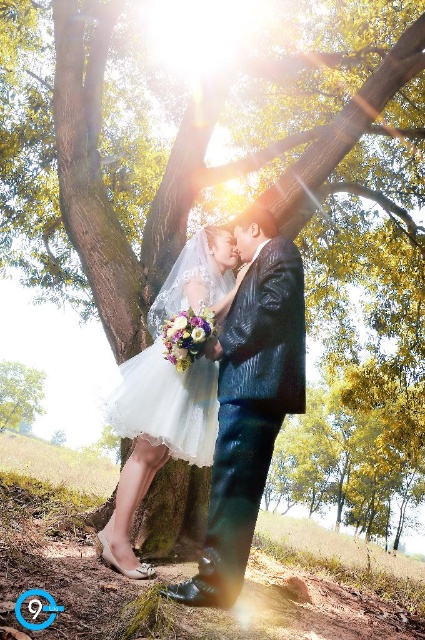
Measure the distance between shiny dark blue suit at center and camera.

shiny dark blue suit at center is 3.25 meters away from camera.

Who is more distant from viewer, (243, 552) or (14, 365)?

The point (14, 365) is more distant.

You are a GUI agent. You are given a task and a screenshot of the screen. Output one action in this format:
    pyautogui.click(x=<x>, y=<y>)
    Task: Click on the shiny dark blue suit at center
    
    Given the screenshot: What is the action you would take?
    (x=249, y=401)

Identify the location of shiny dark blue suit at center. (249, 401).

Can you confirm if matte white dress at center is smaller than green leafy tree at lower left?

Yes.

Measure the distance between matte white dress at center and camera.

The distance of matte white dress at center from camera is 3.66 meters.

Find the location of a particular element. This screenshot has width=425, height=640. matte white dress at center is located at coordinates (167, 390).

Between shiny dark blue suit at center and matte white dress at center, which one is positioned higher?

shiny dark blue suit at center is above.

Does shiny dark blue suit at center come behind matte white dress at center?

That is False.

Who is more distant from viewer, (238,545) or (181,280)?

The point (181,280) is more distant.

At what (x,y) coordinates should I click in order to perform the action: click on shiny dark blue suit at center. Please return your answer as a coordinate pair (x, y). The width and height of the screenshot is (425, 640). Looking at the image, I should click on tap(249, 401).